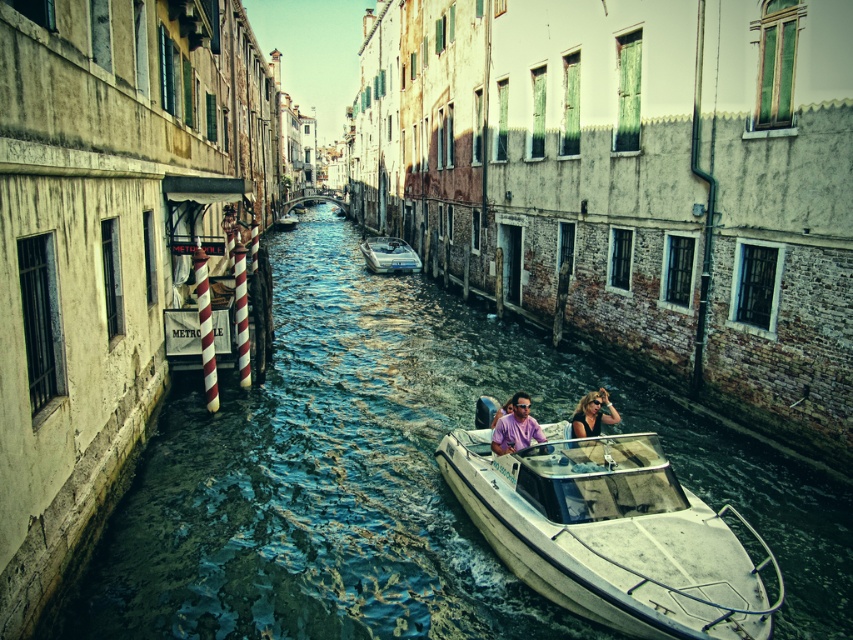
I want to click on shiny metallic boat at center, so click(396, 476).

Which is more to the left, shiny metallic boat at center or purple matte shirt at center?

Positioned to the left is shiny metallic boat at center.

You are a GUI agent. You are given a task and a screenshot of the screen. Output one action in this format:
    pyautogui.click(x=<x>, y=<y>)
    Task: Click on the shiny metallic boat at center
    This screenshot has width=853, height=640.
    Given the screenshot: What is the action you would take?
    pyautogui.click(x=396, y=476)

Find the location of a particular element. The height and width of the screenshot is (640, 853). shiny metallic boat at center is located at coordinates (396, 476).

Consider the image. Can you confirm if matte pink shirt at center is thinner than purple matte shirt at center?

No, matte pink shirt at center is not thinner than purple matte shirt at center.

How distant is matte pink shirt at center from purple matte shirt at center?

They are 1.09 meters apart.

Is point (577, 426) positioned before point (492, 444)?

Yes, it is.

You are a GUI agent. You are given a task and a screenshot of the screen. Output one action in this format:
    pyautogui.click(x=<x>, y=<y>)
    Task: Click on the matte pink shirt at center
    This screenshot has height=640, width=853.
    Given the screenshot: What is the action you would take?
    pyautogui.click(x=593, y=413)

Between white matte boat at center and metallic silver boat at center, which one appears on the left side from the viewer's perspective?

From the viewer's perspective, metallic silver boat at center appears more on the left side.

In the scene shown: Is white matte boat at center bigger than metallic silver boat at center?

Actually, white matte boat at center might be smaller than metallic silver boat at center.

This screenshot has height=640, width=853. In order to click on white matte boat at center in this screenshot , I will do `click(610, 532)`.